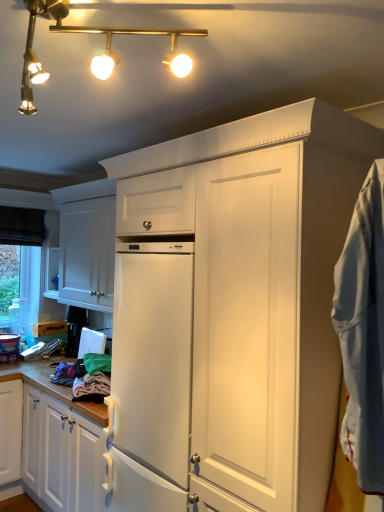
In the scene shown: What is the approximate width of white matte cabinet at upper left?

It is 10.73 inches.

This screenshot has width=384, height=512. Find the location of `white matte cabinet at upper left`. white matte cabinet at upper left is located at coordinates (87, 253).

You are a GUI agent. You are given a task and a screenshot of the screen. Output one action in this format:
    pyautogui.click(x=<x>, y=<y>)
    Task: Click on the white cotton blanket at right
    This screenshot has width=384, height=512.
    Given the screenshot: What is the action you would take?
    pyautogui.click(x=363, y=332)

How many degrees apart are the facing directions of white matte cabinet at upper left and white cotton blanket at right?

The angle between the facing direction of white matte cabinet at upper left and the facing direction of white cotton blanket at right is 99.1 degrees.

Based on the photo, is white matte cabinet at upper left inside the boundaries of white cotton blanket at right, or outside?

white matte cabinet at upper left is outside white cotton blanket at right.

From the image's perspective, is white matte cabinet at upper left beneath white cotton blanket at right?

No, from the image's perspective, white matte cabinet at upper left is not beneath white cotton blanket at right.

Does white matte cabinet at upper left have a smaller size compared to white cotton blanket at right?

Incorrect, white matte cabinet at upper left is not smaller in size than white cotton blanket at right.

Which of these two, gold metallic track lights at upper left or white matte cabinet at upper left, is smaller?

gold metallic track lights at upper left.

Can you confirm if gold metallic track lights at upper left is thinner than white matte cabinet at upper left?

In fact, gold metallic track lights at upper left might be wider than white matte cabinet at upper left.

Is gold metallic track lights at upper left in front of white matte cabinet at upper left?

That is True.

Is gold metallic track lights at upper left directly adjacent to white matte cabinet at upper left?

No, gold metallic track lights at upper left is not next to white matte cabinet at upper left.

Is white matte cabinet at upper left situated inside gold metallic track lights at upper left or outside?

white matte cabinet at upper left lies outside gold metallic track lights at upper left.

Is white matte cabinet at upper left facing towards gold metallic track lights at upper left?

No.

Looking at this image, relative to gold metallic track lights at upper left, is white matte cabinet at upper left in front or behind?

In the image, white matte cabinet at upper left appears behind gold metallic track lights at upper left.

Which is more to the left, white matte cabinet at upper left or gold metallic track lights at upper left?

Positioned to the left is white matte cabinet at upper left.

Is white cotton blanket at right outside of white matte cabinet at upper left?

Indeed, white cotton blanket at right is completely outside white matte cabinet at upper left.

Who is bigger, white cotton blanket at right or white matte cabinet at upper left?

white matte cabinet at upper left is bigger.

Is white cotton blanket at right at the left side of white matte cabinet at upper left?

No.

I want to click on cabinetry above the white cotton blanket at right (from a real-world perspective), so click(87, 253).

The width and height of the screenshot is (384, 512). I want to click on light fixture located above the white cotton blanket at right (from a real-world perspective), so click(x=95, y=56).

Would you say white cotton blanket at right is outside gold metallic track lights at upper left?

white cotton blanket at right is positioned outside gold metallic track lights at upper left.

From a real-world perspective, is white cotton blanket at right positioned over gold metallic track lights at upper left based on gravity?

No, from a real-world perspective, white cotton blanket at right is not on top of gold metallic track lights at upper left.

From the image's perspective, between white cotton blanket at right and gold metallic track lights at upper left, which one is located above?

gold metallic track lights at upper left.

From a real-world perspective, is gold metallic track lights at upper left positioned above or below white cotton blanket at right?

Clearly, from a real-world perspective, gold metallic track lights at upper left is above white cotton blanket at right.

Is gold metallic track lights at upper left not inside white cotton blanket at right?

Yes, gold metallic track lights at upper left is located beyond the bounds of white cotton blanket at right.

In the scene shown: Could you tell me if gold metallic track lights at upper left is turned towards white cotton blanket at right?

No, gold metallic track lights at upper left is not oriented towards white cotton blanket at right.

Identify the location of blanket that appears on the right of gold metallic track lights at upper left. (363, 332).

In the image, there is a white matte cabinet at upper left. At what (x,y) coordinates should I click in order to perform the action: click on blanket below it (from a real-world perspective). Please return your answer as a coordinate pair (x, y). Image resolution: width=384 pixels, height=512 pixels. Looking at the image, I should click on (363, 332).

Where is `cabinetry that is on the left side of gold metallic track lights at upper left`? Image resolution: width=384 pixels, height=512 pixels. cabinetry that is on the left side of gold metallic track lights at upper left is located at coordinates (87, 253).

From the image, which object appears to be farther from gold metallic track lights at upper left, white matte cabinet at upper left or white cotton blanket at right?

white matte cabinet at upper left.

When comparing their distances from white matte cabinet at upper left, does white cotton blanket at right or gold metallic track lights at upper left seem closer?

gold metallic track lights at upper left lies closer to white matte cabinet at upper left than the other object.

Estimate the real-world distances between objects in this image. Which object is further from white cotton blanket at right, white matte cabinet at upper left or gold metallic track lights at upper left?

white matte cabinet at upper left lies further to white cotton blanket at right than the other object.

Based on their spatial positions, is gold metallic track lights at upper left or white matte cabinet at upper left closer to white cotton blanket at right?

gold metallic track lights at upper left lies closer to white cotton blanket at right than the other object.

Considering their positions, is white cotton blanket at right positioned closer to gold metallic track lights at upper left than white matte cabinet at upper left?

white cotton blanket at right.

Considering their positions, is gold metallic track lights at upper left positioned further to white matte cabinet at upper left than white cotton blanket at right?

white cotton blanket at right lies further to white matte cabinet at upper left than the other object.

Where is `blanket positioned between gold metallic track lights at upper left and white matte cabinet at upper left from near to far`? The height and width of the screenshot is (512, 384). blanket positioned between gold metallic track lights at upper left and white matte cabinet at upper left from near to far is located at coordinates (363, 332).